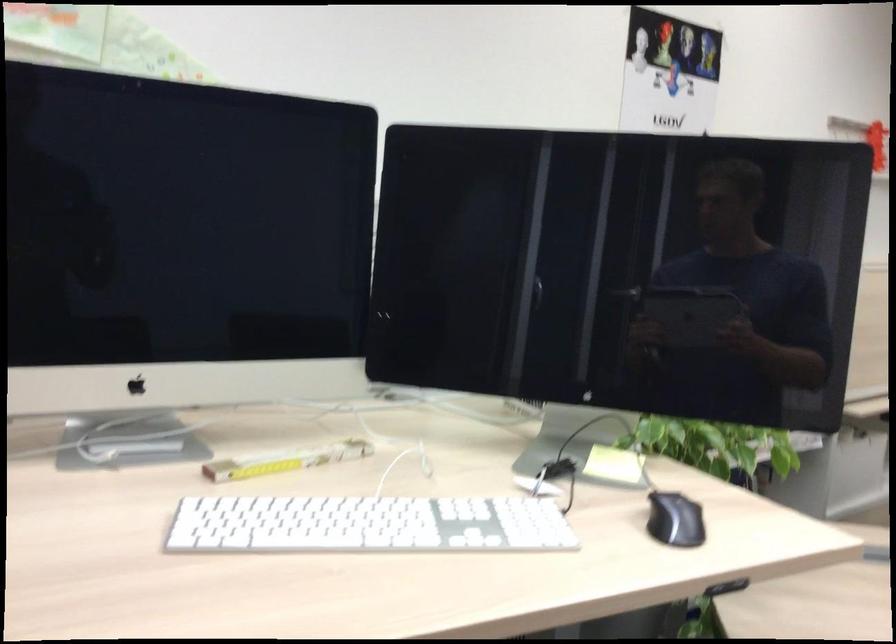
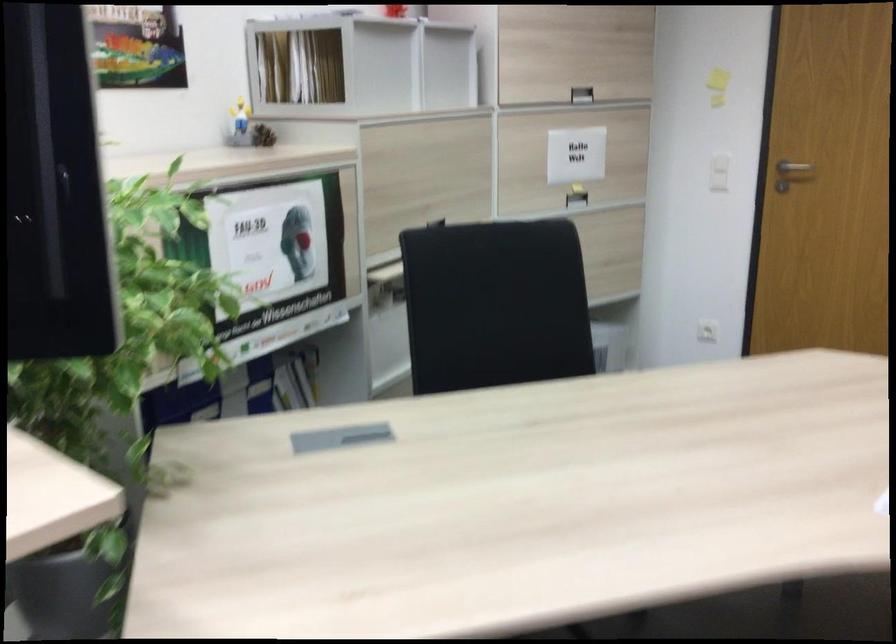
Question: The first image is from the beginning of the video and the second image is from the end. How did the camera likely rotate when shooting the video?

Choices:
 (A) Left
 (B) Right
 (C) Up
 (D) Down

Answer: (B)